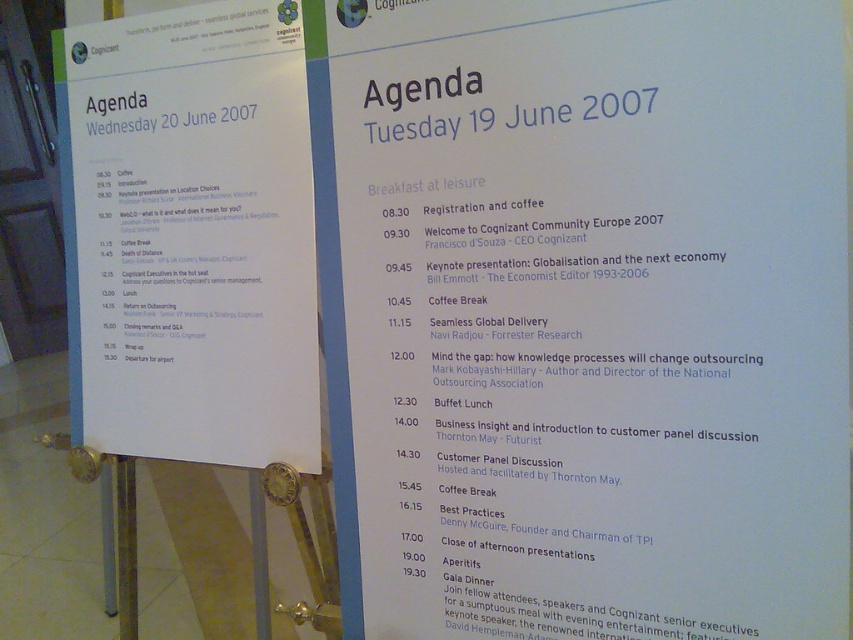
You are organizing a conference and need to display two agendas side by side on a stand. You have a white paper agenda at upper center and a white paper agenda at upper left. Which agenda should you place higher on the stand to ensure both are visible to attendees?

The white paper agenda at upper center should be placed higher because it is taller than the white paper agenda at upper left, ensuring both are visible without one blocking the other.

You are standing in front of two vertical posters displayed on a stand. The posters are titled with different dates. Which agenda is physically nearer to you, the white paper agenda at upper center or the white paper agenda at upper left?

The white paper agenda at upper center is closer to the viewer than the white paper agenda at upper left, so the white paper agenda at upper center is physically nearer to you.